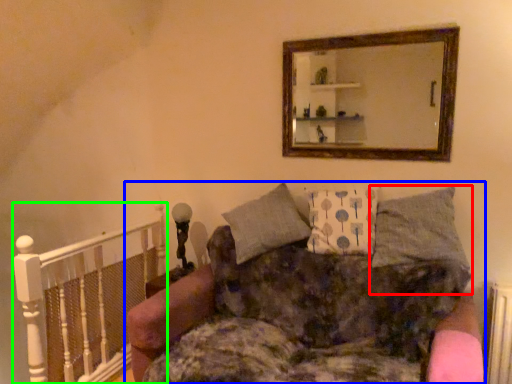
Question: Which object is positioned farthest from pillow (highlighted by a red box)? Select from studio couch (highlighted by a blue box) and balustrade (highlighted by a green box).

Choices:
 (A) studio couch
 (B) balustrade

Answer: (B)